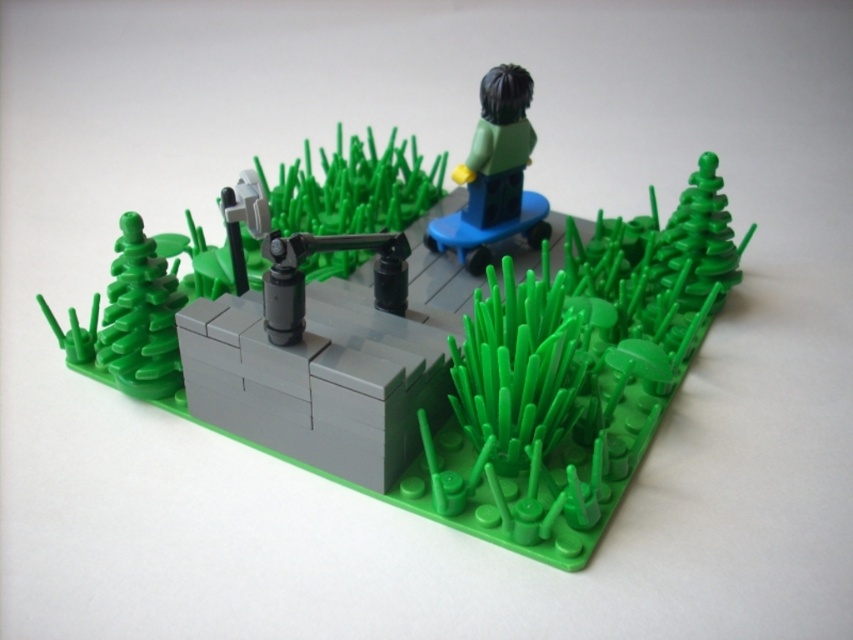
Question: Is smooth gray platform at center thinner than green matte figure at upper center?

Choices:
 (A) yes
 (B) no

Answer: (B)

Question: Can you confirm if smooth gray platform at center is positioned to the left of green matte figure at upper center?

Choices:
 (A) no
 (B) yes

Answer: (B)

Question: Considering the relative positions of smooth gray platform at center and green matte figure at upper center in the image provided, where is smooth gray platform at center located with respect to green matte figure at upper center?

Choices:
 (A) right
 (B) left

Answer: (B)

Question: Which of the following is the closest to the observer?

Choices:
 (A) green matte figure at upper center
 (B) smooth gray platform at center

Answer: (B)